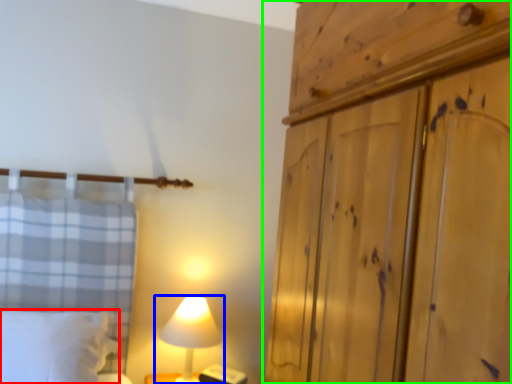
Question: Considering the real-world distances, which object is farthest from pillow (highlighted by a red box)? lamp (highlighted by a blue box) or cupboard (highlighted by a green box)?

Choices:
 (A) lamp
 (B) cupboard

Answer: (B)